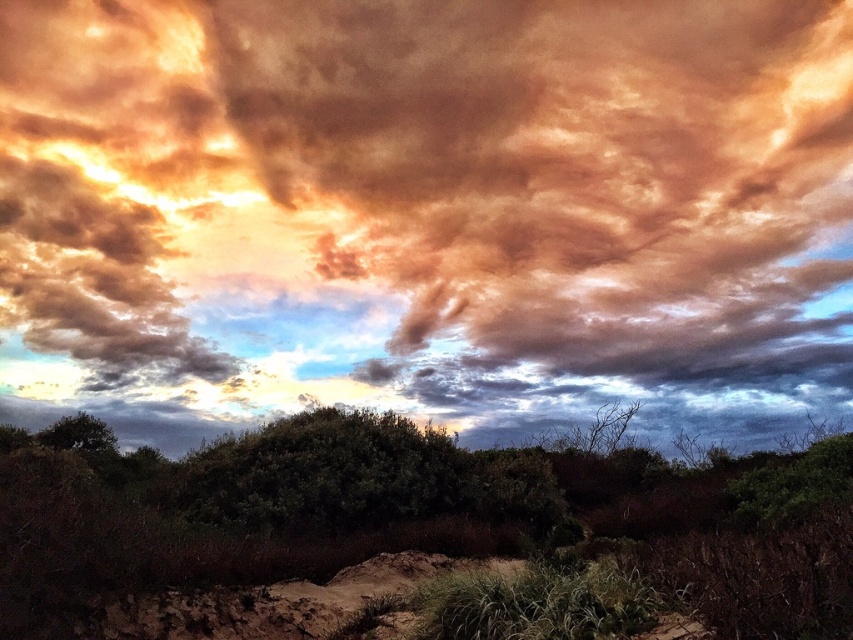
Does matte orange cloud at upper center lie behind green matte shrubs at center?

Yes, it is.

Can you confirm if matte orange cloud at upper center is positioned above green matte shrubs at center?

Yes.

I want to click on matte orange cloud at upper center, so click(x=426, y=212).